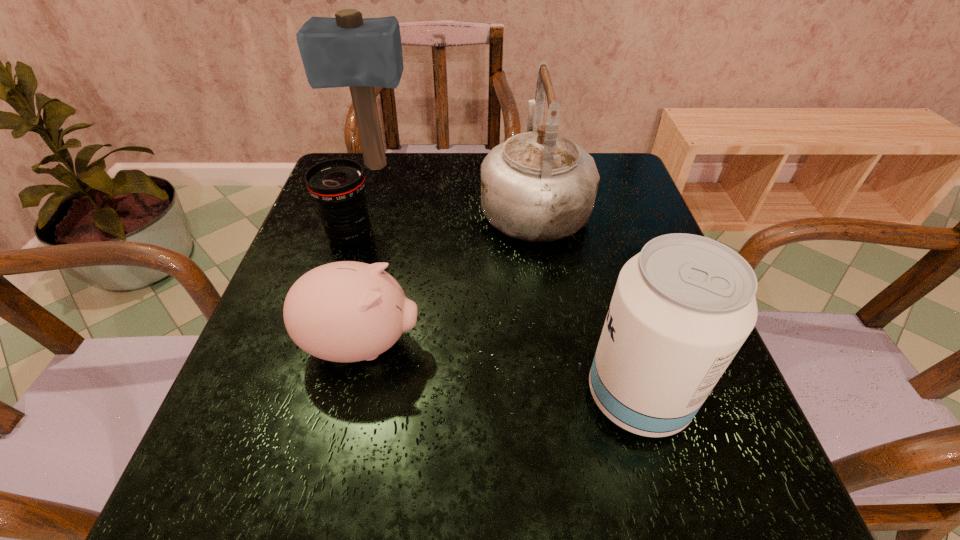
Locate an element on the screen. vacant space located on the back of the telephoto lens is located at coordinates (365, 192).

The height and width of the screenshot is (540, 960). Find the location of `mallet positioned at the far edge`. mallet positioned at the far edge is located at coordinates (350, 51).

Identify the location of kettle that is at the far edge. (538, 186).

This screenshot has width=960, height=540. Find the location of `mallet that is at the left edge`. mallet that is at the left edge is located at coordinates (350, 51).

The width and height of the screenshot is (960, 540). I want to click on piggy bank that is at the left edge, so click(347, 311).

Where is `telephoto lens at the left edge`? This screenshot has width=960, height=540. telephoto lens at the left edge is located at coordinates (337, 185).

Identify the location of kettle positioned at the right edge. The height and width of the screenshot is (540, 960). (538, 186).

This screenshot has height=540, width=960. Identify the location of alcohol that is at the right edge. (682, 308).

I want to click on object present at the far left corner, so click(x=350, y=51).

Locate an element on the screen. The image size is (960, 540). object located at the far right corner is located at coordinates (538, 186).